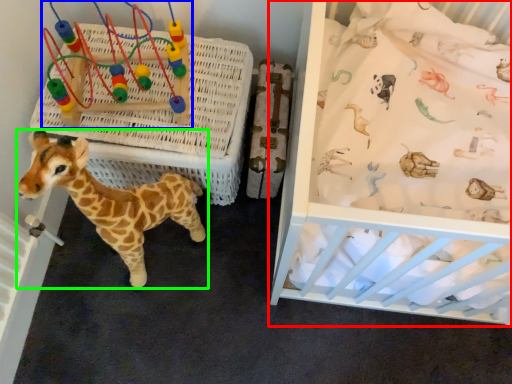
Question: Considering the real-world distances, which object is closest to infant bed (highlighted by a red box)? toy (highlighted by a blue box) or giraffe (highlighted by a green box).

Choices:
 (A) toy
 (B) giraffe

Answer: (B)